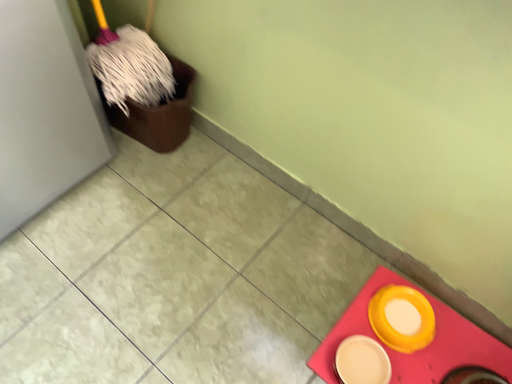
Find the location of a particular element. This screenshot has width=512, height=384. spots to the right of yellow matte bowl at lower right, the 2th tableware from the left is located at coordinates (457, 337).